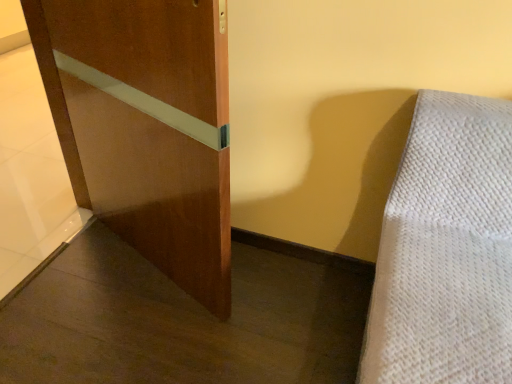
The image size is (512, 384). What are the coordinates of `free space that is to the left of glossy wood door at center` in the screenshot? It's located at (64, 259).